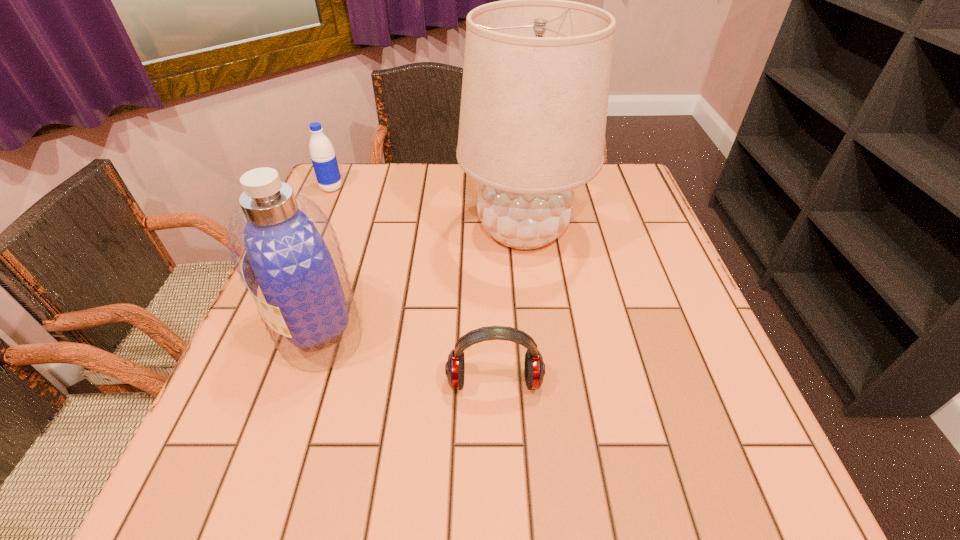
The height and width of the screenshot is (540, 960). In order to click on object that stands as the second closest to the second shortest object in this screenshot , I will do `click(282, 244)`.

Identify the location of the third closest object to the third tallest object. Image resolution: width=960 pixels, height=540 pixels. (534, 366).